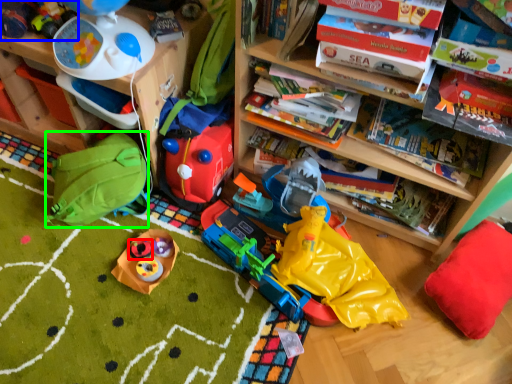
Question: Considering the real-world distances, which object is closest to toy (highlighted by a red box)? toy (highlighted by a blue box) or backpack (highlighted by a green box).

Choices:
 (A) toy
 (B) backpack

Answer: (B)